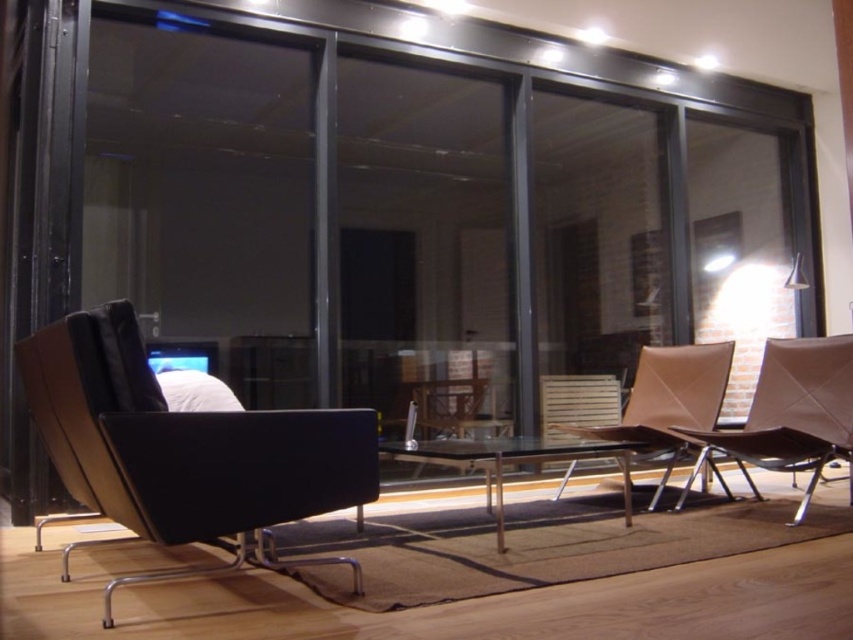
You are standing at the entrance of the living room and want to move towards the brown leather chair at lower right. Which direction should you move relative to the black leather swivel chair at left?

The black leather swivel chair at left is located above the brown leather chair at lower right, so you should move downward towards the brown leather chair at lower right from the black leather swivel chair at left.

You are a delivery robot with a package that is 12 inches wide. You need to move from the brown leather chair at lower right to the leather textured chair at center. Can you pass through the space between them without tilting the package?

The distance between the brown leather chair at lower right and the leather textured chair at center is 12.60 inches, which is wider than the 12 inches package. Therefore, the delivery robot can pass through the space between them without tilting the package.

You are standing at the entrance of the living room and want to sit in the leather textured chair at center. Which direction should you move to reach it?

The leather textured chair at center is located at point (668, 401), so you should move towards the center of the room to reach it.